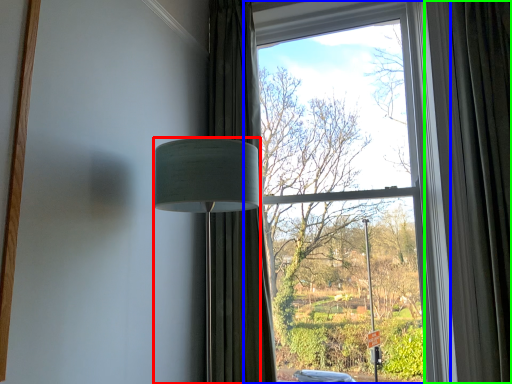
Question: Which object is positioned closest to lamp (highlighted by a red box)? Select from window (highlighted by a blue box) and curtain (highlighted by a green box).

Choices:
 (A) window
 (B) curtain

Answer: (B)